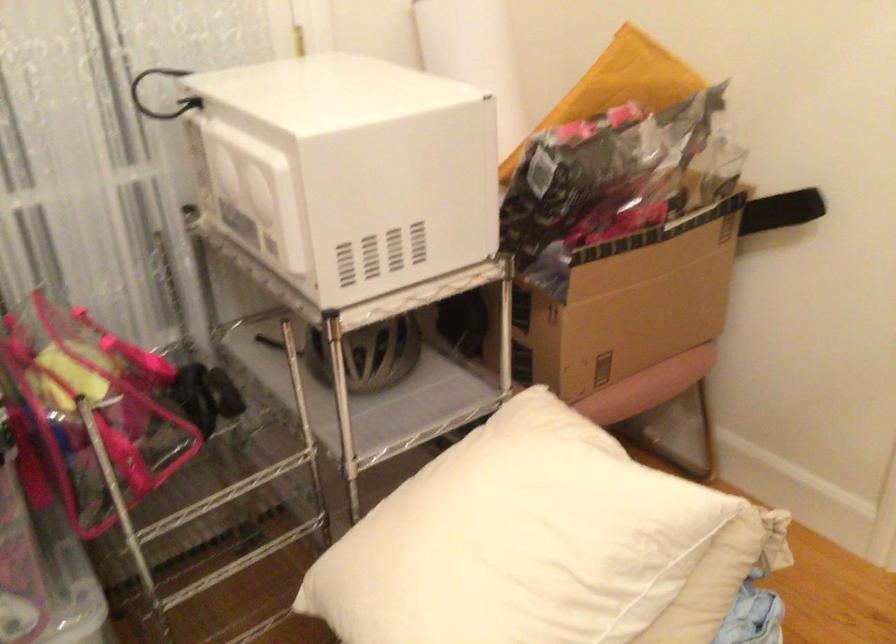
The first image is from the beginning of the video and the second image is from the end. How did the camera likely rotate when shooting the video?

The camera's rotation is toward right-down.